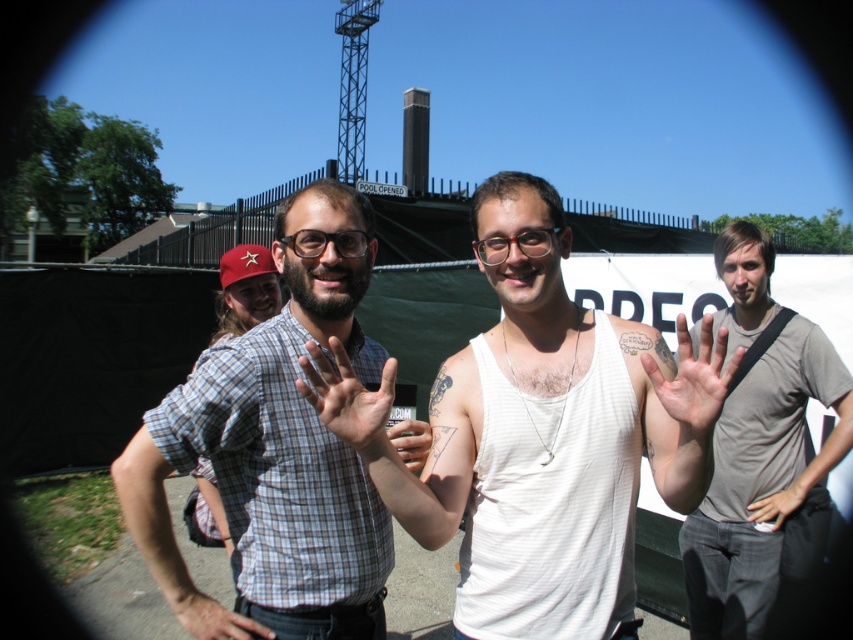
You are a photographer trying to capture the white matte hand at center in your shot. Where exactly should you position your camera to ensure the hand is in the frame?

Position your camera at point (776, 506) to capture the white matte hand at center.

You are a photographer trying to capture a candid shot of the two people at the center of the scene. The checkered fabric shirt at center and the transparent plastic glasses at center are both in your frame. Based on their positions, which object is closer to the left edge of your camera view?

The checkered fabric shirt at center is to the left of transparent plastic glasses at center, so it is closer to the left edge of the camera view.

You are an event organizer who needs to ensure that the checkered fabric shirt at center and the transparent plastic glasses at center are visible to attendees from a distance. Given their sizes, which object should you place closer to the front for better visibility?

The checkered fabric shirt at center is larger in size than the transparent plastic glasses at center, so placing the transparent plastic glasses at center closer to the front would ensure better visibility since smaller objects need to be positioned nearer to be seen clearly.